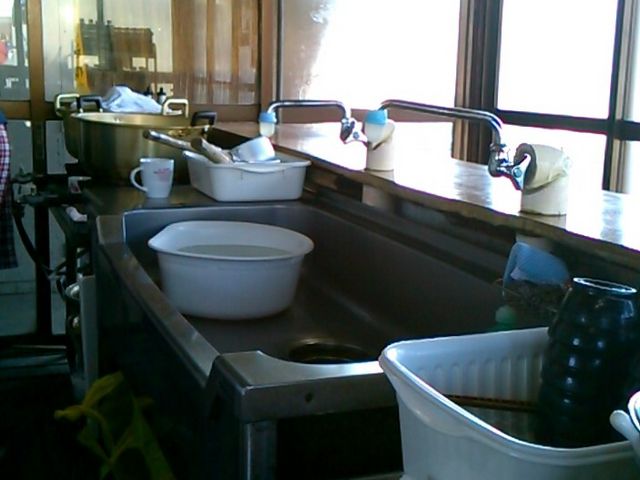
At what (x,y) coordinates should I click in order to perform the action: click on silver metal faucet. Please return your answer as a coordinate pair (x, y). Looking at the image, I should click on (457, 107).